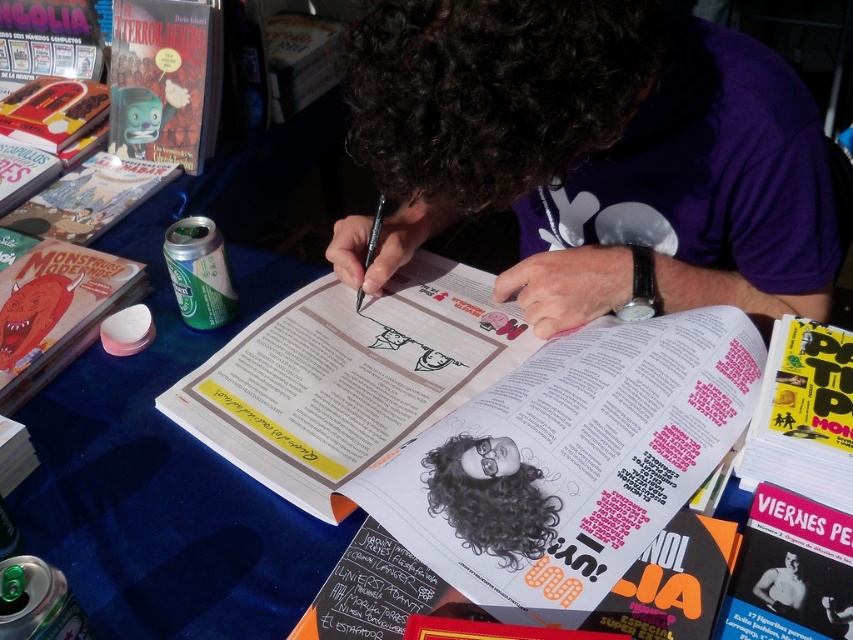
Who is more distant from viewer, (782, 406) or (379, 198)?

Positioned behind is point (379, 198).

Locate an element on the screen. yellow paper magazine at upper right is located at coordinates (804, 413).

Locate an element on the screen. yellow paper magazine at upper right is located at coordinates (804, 413).

Is point (546, 364) closer to camera compared to point (767, 579)?

No, it is not.

Does matte paper magazine at center have a greater height compared to smooth skin man at center?

Yes.

Between point (529, 392) and point (792, 600), which one is positioned behind?

Point (529, 392)

Find the location of a particular element. matte paper magazine at center is located at coordinates (479, 426).

Who is more forward, (20, 337) or (782, 570)?

Point (782, 570) is more forward.

You are a GUI agent. You are given a task and a screenshot of the screen. Output one action in this format:
    pyautogui.click(x=<x>, y=<y>)
    Task: Click on the matte paper magazine at left
    
    Given the screenshot: What is the action you would take?
    pyautogui.click(x=56, y=310)